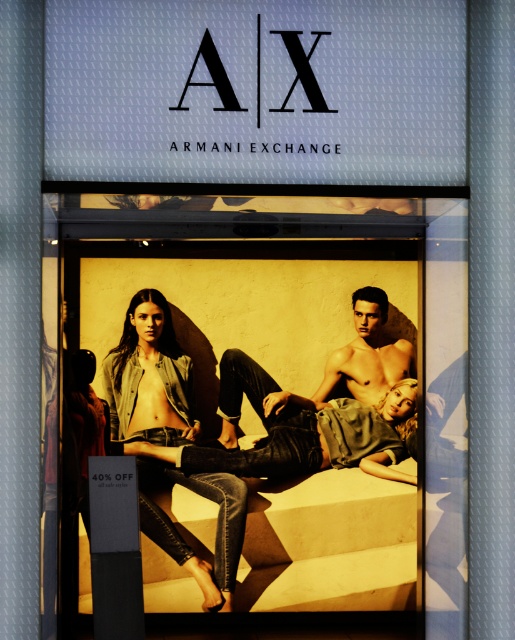
Question: Among these objects, which one is nearest to the camera?

Choices:
 (A) denim jacket at center
 (B) denim jeans at center

Answer: (B)

Question: Is denim jeans at center wider than denim jacket at center?

Choices:
 (A) yes
 (B) no

Answer: (A)

Question: Is denim jeans at center bigger than denim jacket at center?

Choices:
 (A) no
 (B) yes

Answer: (B)

Question: Is denim jeans at center positioned behind denim jacket at center?

Choices:
 (A) yes
 (B) no

Answer: (B)

Question: Which point is closer to the camera taking this photo?

Choices:
 (A) (71, 236)
 (B) (152, 324)

Answer: (A)